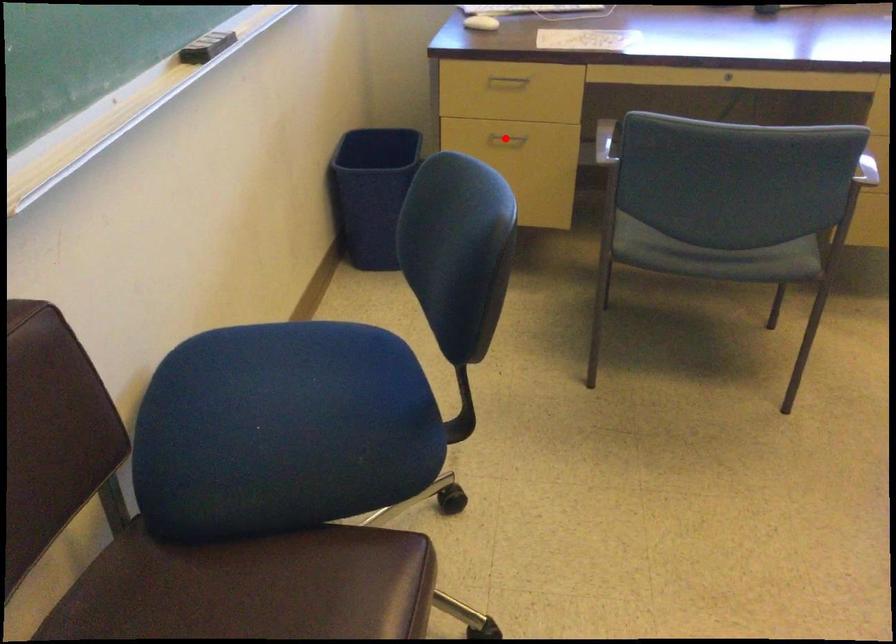
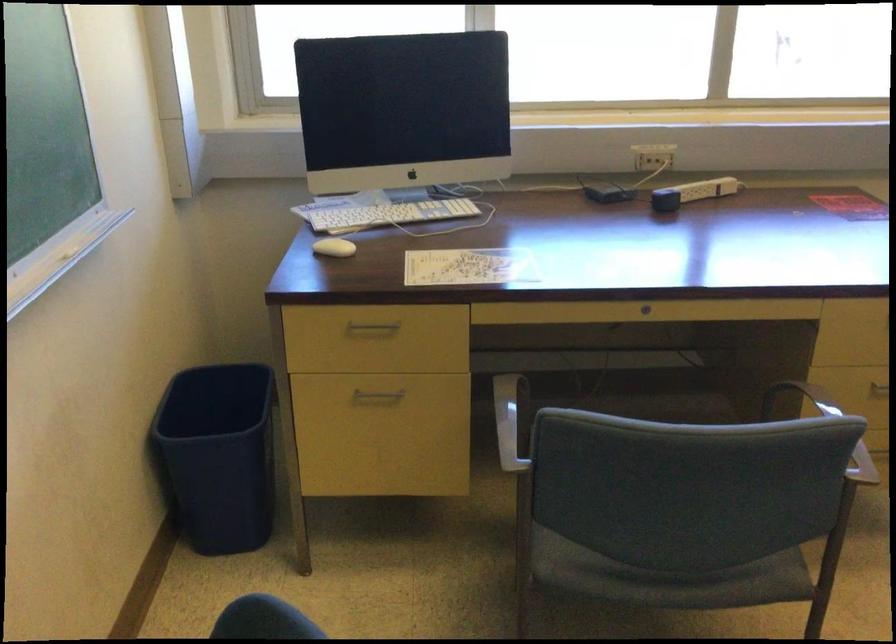
In the second image, find the point that corresponds to the highlighted location in the first image.

(376, 395)